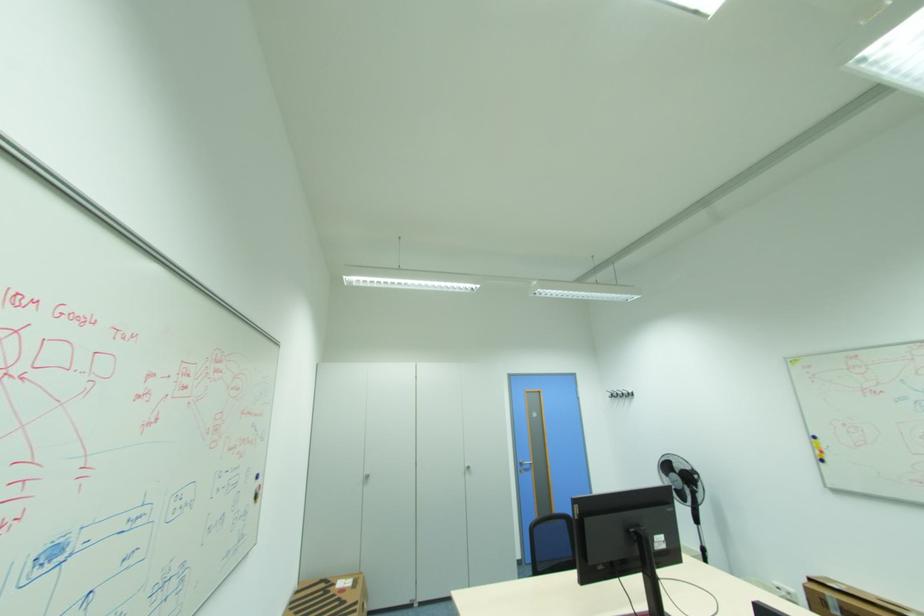
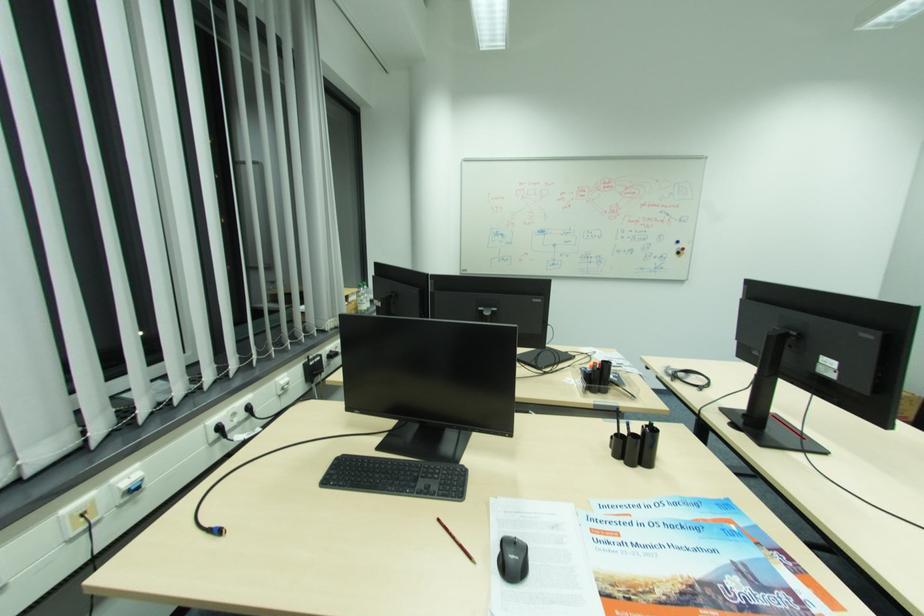
Locate, in the second image, the point that corresponds to (x=261, y=496) in the first image.

(684, 253)